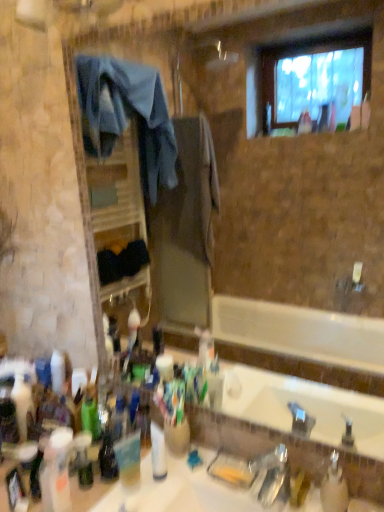
What are the coordinates of `free space in front of white glossy bottle at center, the 2th bottle positioned from the right` in the screenshot? It's located at (164, 500).